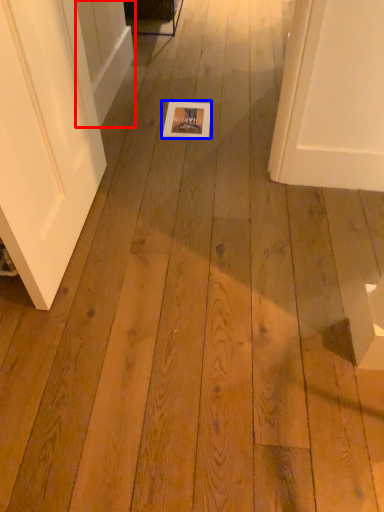
Question: Which object appears closest to the camera in this image, screen door (highlighted by a red box) or postcard (highlighted by a blue box)?

Choices:
 (A) screen door
 (B) postcard

Answer: (A)